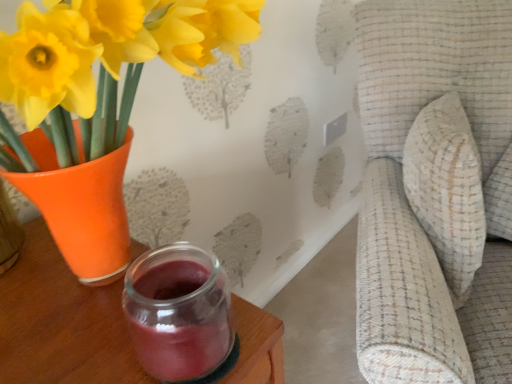
Question: Is matte orange vase at left a part of textured beige cushion at right?

Choices:
 (A) yes
 (B) no

Answer: (B)

Question: Is textured beige cushion at right wider than matte orange vase at left?

Choices:
 (A) yes
 (B) no

Answer: (A)

Question: Considering the relative positions of textured beige cushion at right and matte orange vase at left in the image provided, is textured beige cushion at right in front of matte orange vase at left?

Choices:
 (A) yes
 (B) no

Answer: (B)

Question: Is textured beige cushion at right oriented away from matte orange vase at left?

Choices:
 (A) no
 (B) yes

Answer: (A)

Question: From the image's perspective, is textured beige cushion at right above matte orange vase at left?

Choices:
 (A) no
 (B) yes

Answer: (A)

Question: Relative to textured beige cushion at right, is matte orange vase at left in front or behind?

Choices:
 (A) front
 (B) behind

Answer: (A)

Question: Considering the positions of point (146, 18) and point (430, 82), is point (146, 18) closer or farther from the camera than point (430, 82)?

Choices:
 (A) farther
 (B) closer

Answer: (B)

Question: From the image's perspective, relative to textured beige cushion at right, is matte orange vase at left above or below?

Choices:
 (A) above
 (B) below

Answer: (A)

Question: Considering the relative positions of matte orange vase at left and textured beige cushion at right in the image provided, is matte orange vase at left to the left or to the right of textured beige cushion at right?

Choices:
 (A) right
 (B) left

Answer: (B)

Question: Considering the positions of point tap(87, 3) and point tap(73, 284), is point tap(87, 3) closer or farther from the camera than point tap(73, 284)?

Choices:
 (A) closer
 (B) farther

Answer: (A)

Question: Considering the positions of matte orange vase at left and transparent glass jar at lower center in the image, is matte orange vase at left taller or shorter than transparent glass jar at lower center?

Choices:
 (A) short
 (B) tall

Answer: (B)

Question: Would you say matte orange vase at left is to the left or to the right of transparent glass jar at lower center in the picture?

Choices:
 (A) right
 (B) left

Answer: (B)

Question: From a real-world perspective, is matte orange vase at left above or below transparent glass jar at lower center?

Choices:
 (A) below
 (B) above

Answer: (B)

Question: Considering their positions, is transparent glass jar at lower center located in front of or behind matte orange vase at left?

Choices:
 (A) front
 (B) behind

Answer: (B)

Question: Is transparent glass jar at lower center spatially inside matte orange vase at left, or outside of it?

Choices:
 (A) outside
 (B) inside

Answer: (B)